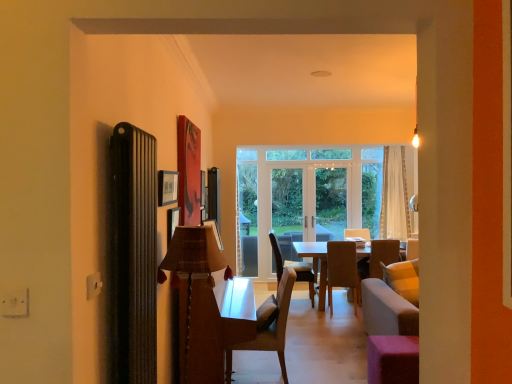
Question: Does white sheer curtain at center come in front of clear glass door at center, arranged as the 1th screen door when viewed from the right?

Choices:
 (A) yes
 (B) no

Answer: (A)

Question: Considering the relative positions of white sheer curtain at center and clear glass door at center, the second screen door when ordered from left to right, in the image provided, is white sheer curtain at center behind clear glass door at center, the second screen door when ordered from left to right,?

Choices:
 (A) no
 (B) yes

Answer: (A)

Question: Is white sheer curtain at center placed right next to clear glass door at center, the second screen door when ordered from left to right?

Choices:
 (A) yes
 (B) no

Answer: (B)

Question: Is white sheer curtain at center facing away from clear glass door at center, the second screen door when ordered from left to right?

Choices:
 (A) yes
 (B) no

Answer: (B)

Question: Considering the relative sizes of white sheer curtain at center and clear glass door at center, the second screen door when ordered from left to right, in the image provided, is white sheer curtain at center bigger than clear glass door at center, the second screen door when ordered from left to right,?

Choices:
 (A) no
 (B) yes

Answer: (A)

Question: In terms of width, does plaid fabric lampshade at center look wider or thinner when compared to white glossy screen door at center, the 2th screen door viewed from the right?

Choices:
 (A) wide
 (B) thin

Answer: (A)

Question: In terms of height, does plaid fabric lampshade at center look taller or shorter compared to white glossy screen door at center, positioned as the first screen door in left-to-right order?

Choices:
 (A) short
 (B) tall

Answer: (A)

Question: Considering the positions of plaid fabric lampshade at center and white glossy screen door at center, the 2th screen door viewed from the right, in the image, is plaid fabric lampshade at center bigger or smaller than white glossy screen door at center, the 2th screen door viewed from the right,?

Choices:
 (A) small
 (B) big

Answer: (B)

Question: Is plaid fabric lampshade at center in front of or behind white glossy screen door at center, positioned as the first screen door in left-to-right order, in the image?

Choices:
 (A) behind
 (B) front

Answer: (B)

Question: Which is correct: plaid fabric lampshade at center is inside matte black picture frame at upper left, or outside of it?

Choices:
 (A) inside
 (B) outside

Answer: (B)

Question: Does point click(x=204, y=243) appear closer or farther from the camera than point click(x=163, y=203)?

Choices:
 (A) farther
 (B) closer

Answer: (B)

Question: Considering the relative positions of plaid fabric lampshade at center and matte black picture frame at upper left in the image provided, is plaid fabric lampshade at center to the left or to the right of matte black picture frame at upper left?

Choices:
 (A) left
 (B) right

Answer: (B)

Question: Is plaid fabric lampshade at center in front of or behind matte black picture frame at upper left in the image?

Choices:
 (A) front
 (B) behind

Answer: (A)

Question: Considering the positions of point (272, 228) and point (400, 190), is point (272, 228) closer or farther from the camera than point (400, 190)?

Choices:
 (A) closer
 (B) farther

Answer: (B)

Question: Would you say clear glass door at center, the second screen door when ordered from left to right, is inside or outside white sheer curtain at center?

Choices:
 (A) outside
 (B) inside

Answer: (A)